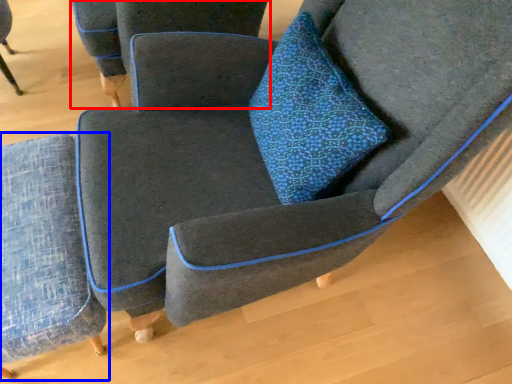
Question: Which object appears closest to the camera in this image, chair (highlighted by a red box) or chair (highlighted by a blue box)?

Choices:
 (A) chair
 (B) chair

Answer: (B)